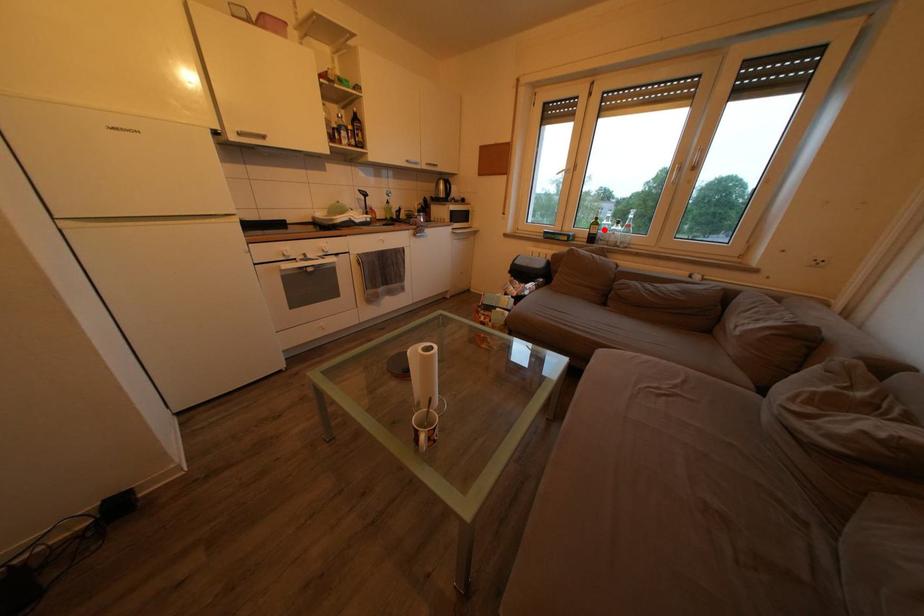
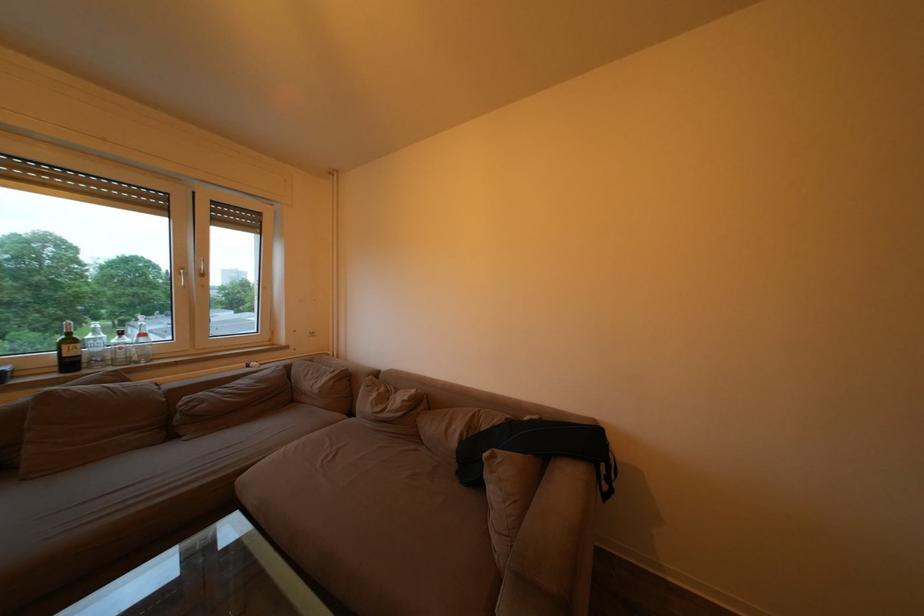
Where in the second image is the point corresponding to the highlighted location from the first image?

(79, 347)